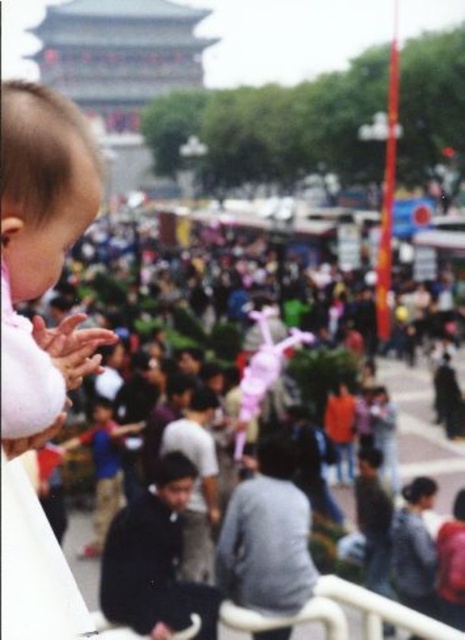
Question: Does matte pink toy at center appear under purple fabric toy at center?

Choices:
 (A) no
 (B) yes

Answer: (A)

Question: Does soft pink fabric at left appear over white matte hand at lower left?

Choices:
 (A) yes
 (B) no

Answer: (A)

Question: Can you confirm if matte pink toy at center is wider than purple fabric toy at center?

Choices:
 (A) no
 (B) yes

Answer: (B)

Question: Based on their relative distances, which object is farther from the soft pink fabric at left?

Choices:
 (A) purple fabric toy at center
 (B) white matte hand at lower left
 (C) matte pink toy at center

Answer: (C)

Question: Which point is closer to the camera?

Choices:
 (A) (265, 385)
 (B) (66, 340)

Answer: (B)

Question: Among these points, which one is farthest from the camera?

Choices:
 (A) (41, 364)
 (B) (154, 257)
 (C) (279, 356)

Answer: (B)